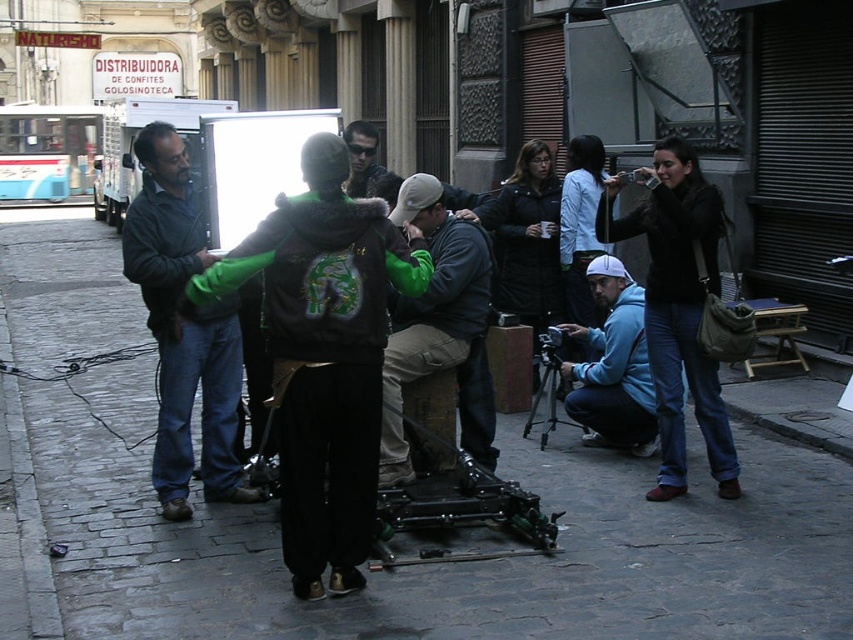
You are standing at the entrance of the street scene and want to find the dark blue jeans at center. Based on their coordinates, in which direction should you look to locate them?

The dark blue jeans at center is located at point 0.516 on the x axis and 0.216 on the y axis. Since the x coordinate is closer to 1, it is more to the right side of the image, and the y coordinate is closer to 0, meaning it is lower in the image. So you should look towards the lower right direction to locate the dark blue jeans at center.

You are standing at the origin point of the coordinate system in the image. The green fuzzy jacket at center is located at point (323, 355). If you want to walk directly to the green fuzzy jacket at center, which direction should you move in terms of the coordinate system?

To reach the green fuzzy jacket at center located at point (323, 355) from the origin, you should move in the positive x and positive y direction since both coordinates are greater than zero.